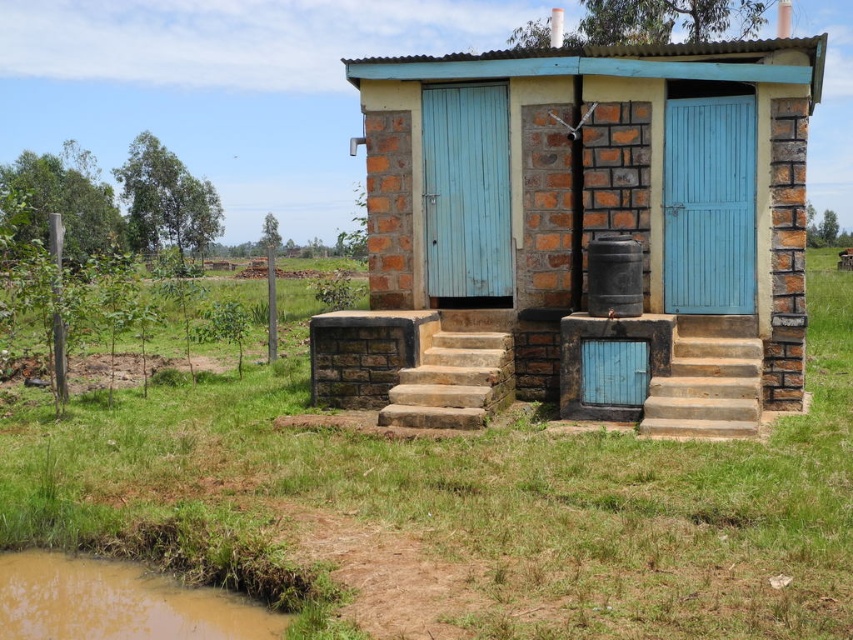
Who is more forward, (445, 369) or (740, 394)?

Point (740, 394) is in front.

Which is in front, point (639, 234) or point (677, 316)?

Point (677, 316)

Find the location of a particular element. This screenshot has width=853, height=640. blue painted wood toilet at center is located at coordinates (579, 230).

Based on the photo, can you confirm if blue painted wood toilet at center is shorter than brown muddy puddle at lower left?

In fact, blue painted wood toilet at center may be taller than brown muddy puddle at lower left.

Does blue painted wood toilet at center appear under brown muddy puddle at lower left?

Actually, blue painted wood toilet at center is above brown muddy puddle at lower left.

This screenshot has height=640, width=853. Identify the location of blue painted wood toilet at center. (579, 230).

Between point (392, 232) and point (456, 208), which one is positioned in front?

Point (456, 208)

Does blue painted wood toilet at center come behind light blue wooden door at center?

No, it is not.

Identify the location of blue painted wood toilet at center. (579, 230).